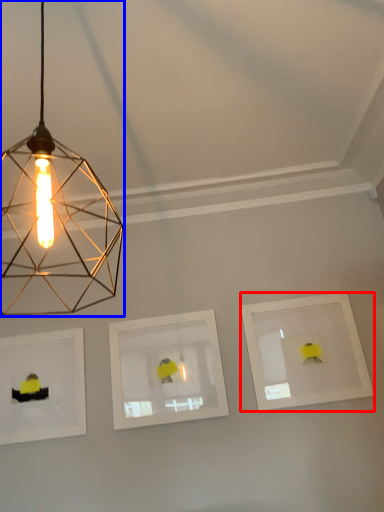
Question: Which point is closer to the camera, picture frame (highlighted by a red box) or lamp (highlighted by a blue box)?

Choices:
 (A) picture frame
 (B) lamp

Answer: (B)